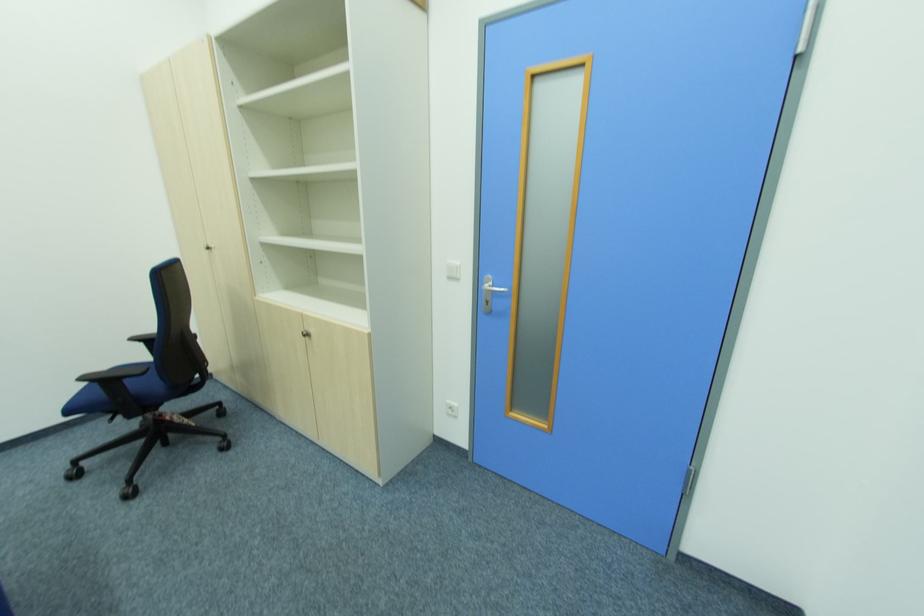
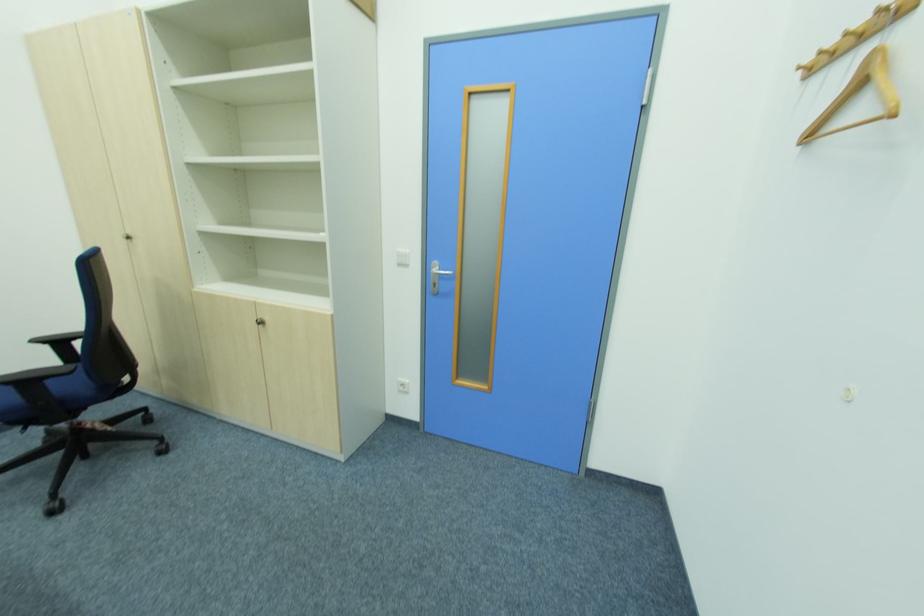
Where in the second image is the point corresponding to (171,419) from the first image?

(91, 429)